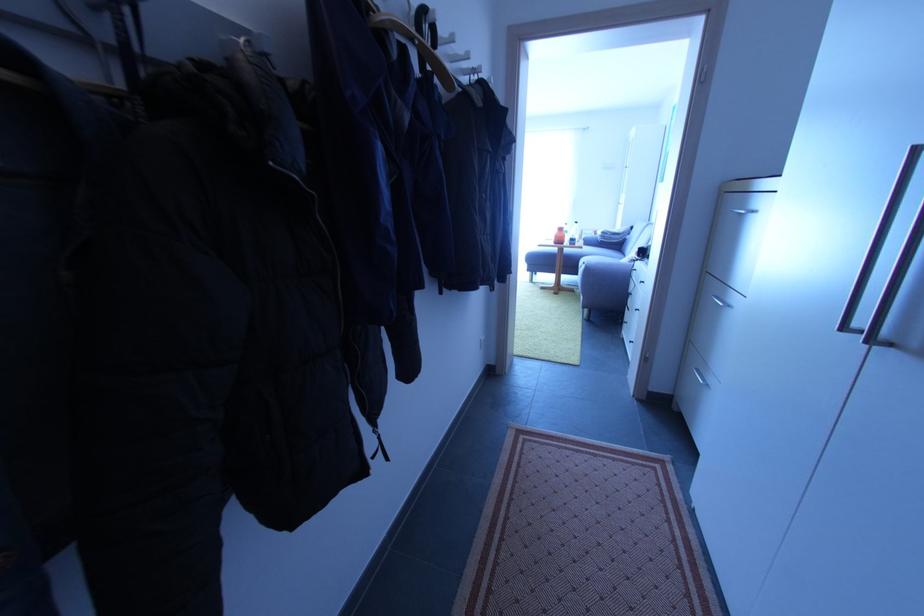
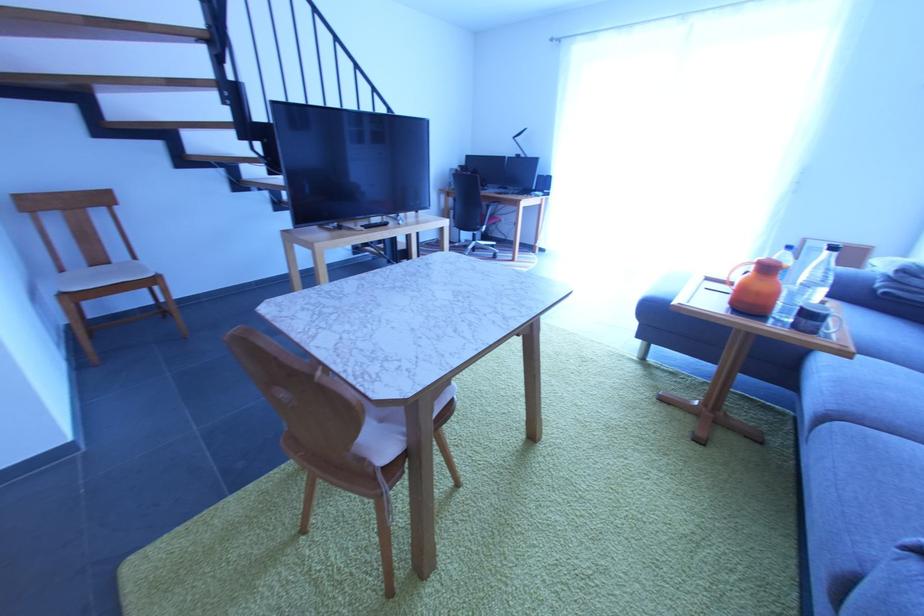
In the second image, find the point that corresponds to point (586, 268) in the first image.

(833, 419)